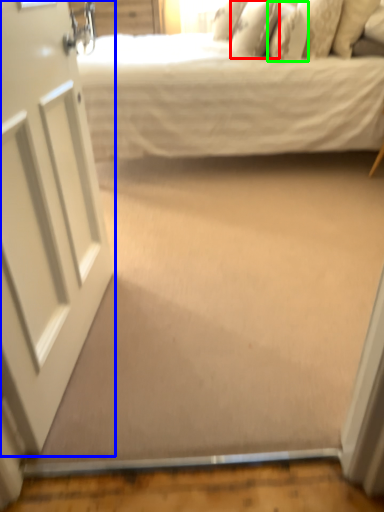
Question: Considering the real-world distances, which object is closest to pillow (highlighted by a red box)? door (highlighted by a blue box) or pillow (highlighted by a green box).

Choices:
 (A) door
 (B) pillow

Answer: (B)